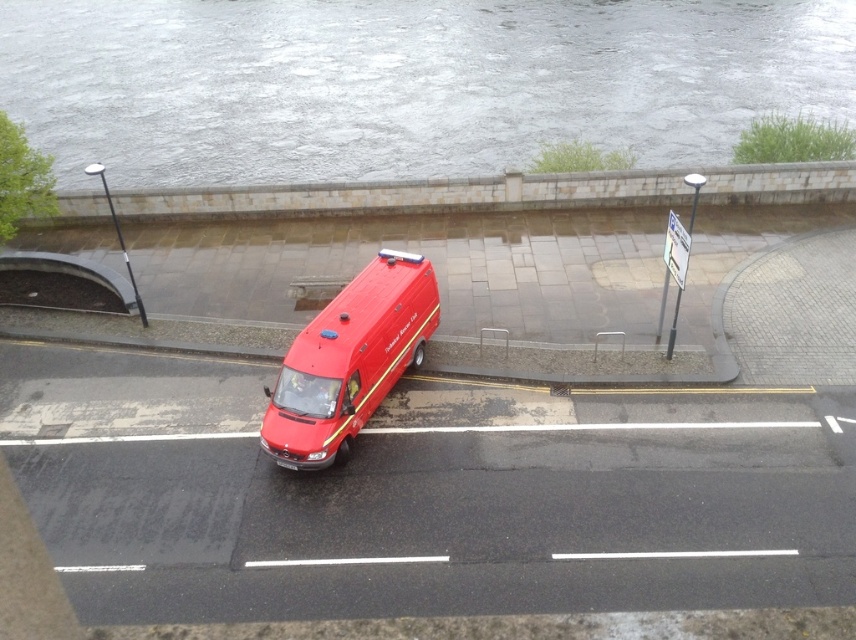
Is gray stone wall at upper center thinner than shiny red van at center?

No.

Who is shorter, gray stone wall at upper center or shiny red van at center?

Standing shorter between the two is shiny red van at center.

Measure the distance between gray stone wall at upper center and camera.

gray stone wall at upper center and camera are 29.71 meters apart from each other.

This screenshot has width=856, height=640. Find the location of `gray stone wall at upper center`. gray stone wall at upper center is located at coordinates (406, 83).

Is the position of shiny red van at center more distant than that of white plastic sign at upper right?

That is False.

I want to click on shiny red van at center, so click(349, 360).

Between stone at upper center and white plastic sign at upper right, which one is positioned higher?

stone at upper center is higher up.

At what (x,y) coordinates should I click in order to perform the action: click on stone at upper center. Please return your answer as a coordinate pair (x, y). The image size is (856, 640). Looking at the image, I should click on (408, 196).